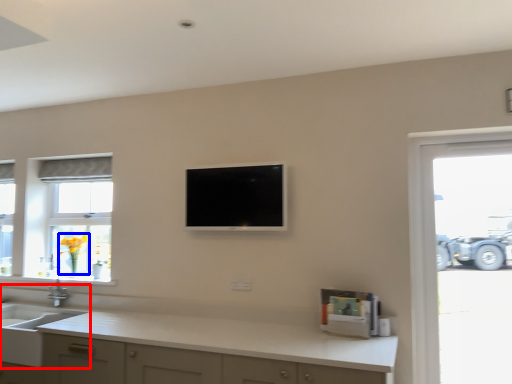
Question: Which of the following is the closest to the observer, sink (highlighted by a red box) or flower (highlighted by a blue box)?

Choices:
 (A) sink
 (B) flower

Answer: (A)